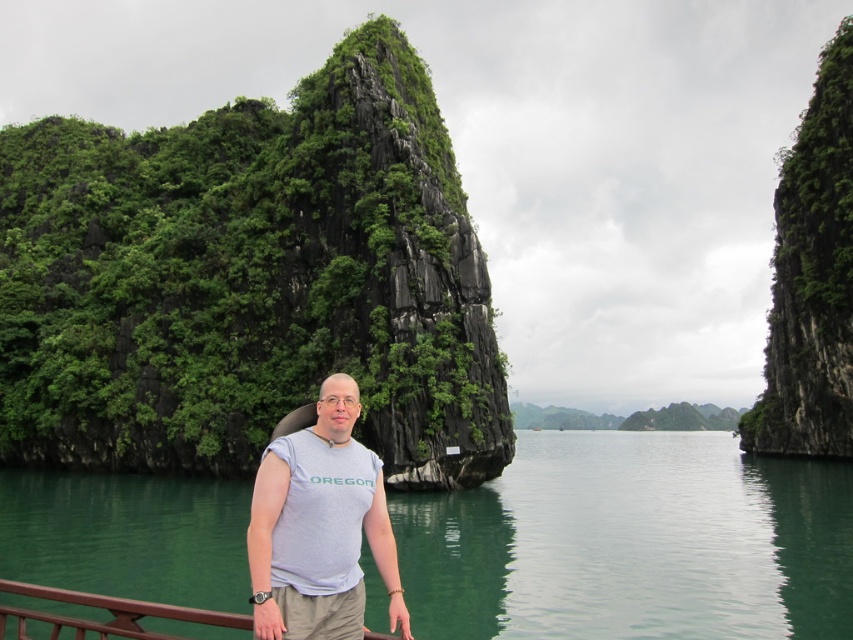
What is located at the coordinates point (631, 544) in the image?

The point (631, 544) indicates green liquid water at center.